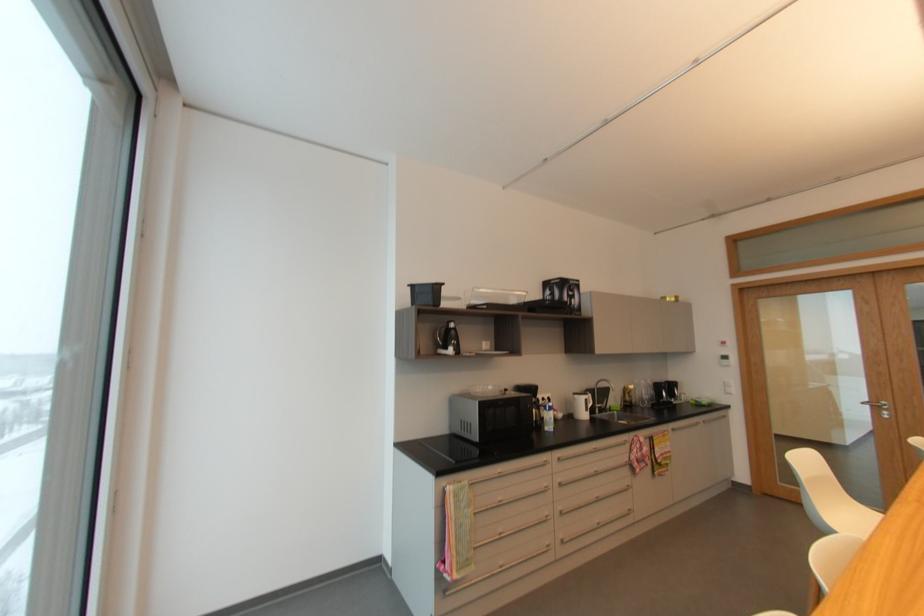
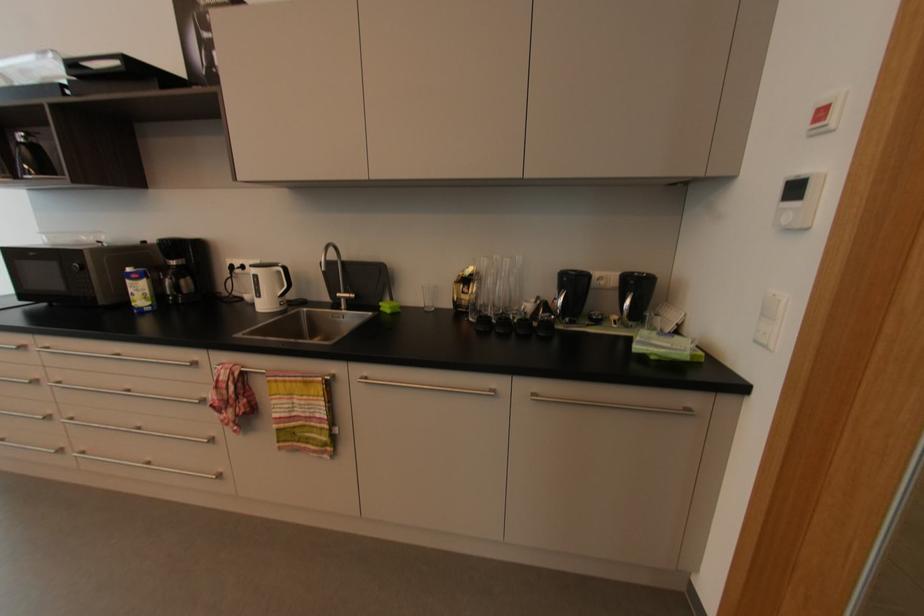
Find the pixel in the second image that matches (x=602, y=408) in the first image.

(350, 300)